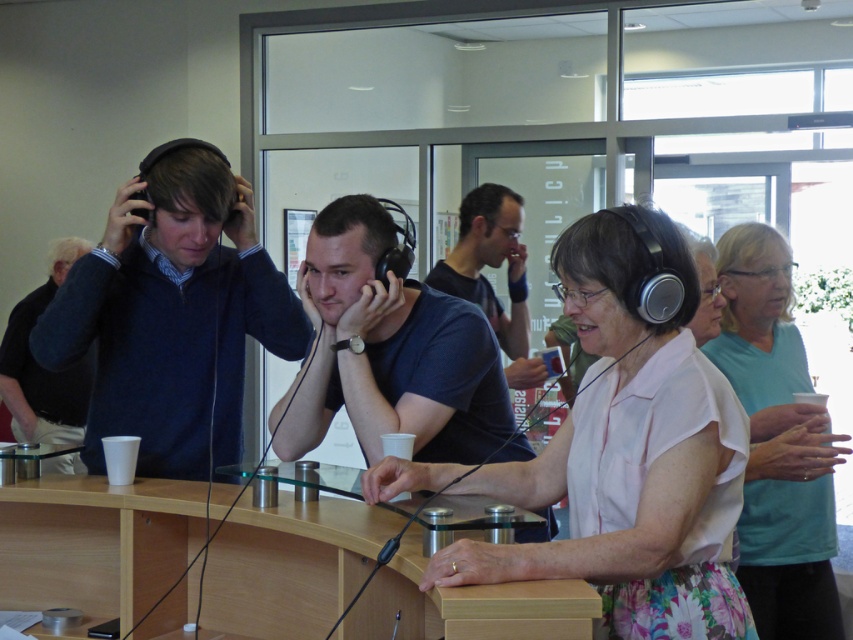
Question: Observing the image, what is the correct spatial positioning of matte blue sweater at left in reference to matte blue shirt at center?

Choices:
 (A) right
 (B) left

Answer: (B)

Question: Which of these objects is positioned closest to the matte blue sweater at left?

Choices:
 (A) dark blue sweater at left
 (B) matte black headphones at center
 (C) white floral dress at center

Answer: (B)

Question: Is wooden table at center below matte black headphones at center?

Choices:
 (A) yes
 (B) no

Answer: (A)

Question: Is matte blue sweater at left positioned before matte black headphones at center?

Choices:
 (A) no
 (B) yes

Answer: (A)

Question: Which of the following is the farthest from the observer?

Choices:
 (A) (755, 333)
 (B) (508, 273)
 (C) (590, 579)

Answer: (B)

Question: Considering the real-world distances, which object is closest to the wooden table at center?

Choices:
 (A) matte blue shirt at center
 (B) dark blue sweater at left

Answer: (A)